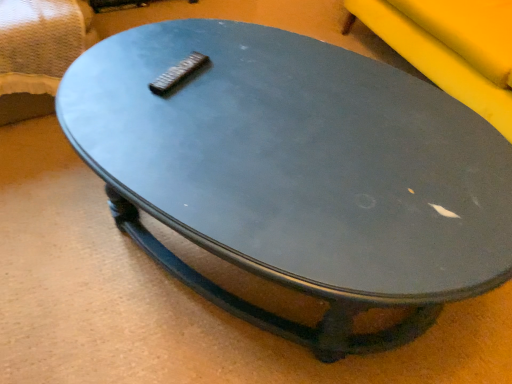
The width and height of the screenshot is (512, 384). What are the coordinates of `vacant area in front of black plastic remote at center` in the screenshot? It's located at (173, 113).